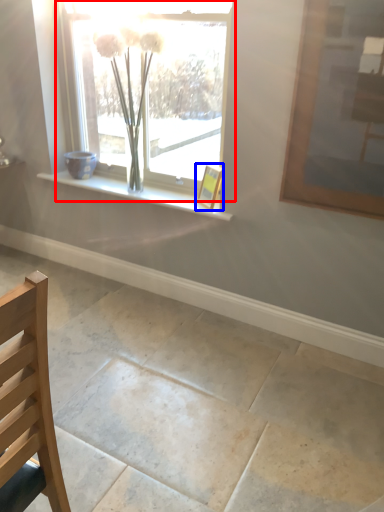
Question: Among these objects, which one is nearest to the camera, window (highlighted by a red box) or picture frame (highlighted by a blue box)?

Choices:
 (A) window
 (B) picture frame

Answer: (A)